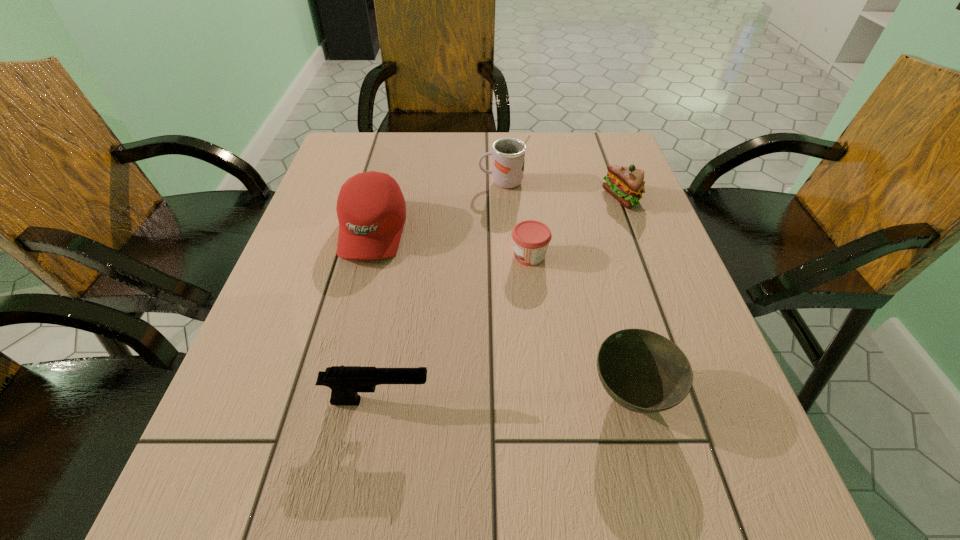
The height and width of the screenshot is (540, 960). Identify the location of free space that satisfies the following two spatial constraints: 1. on the side with the handle of the cup; 2. on the right side of the bowl. (516, 395).

Where is `vacant space that satisfies the following two spatial constraints: 1. on the back side of the bowl; 2. on the front label of the shortest object`? The height and width of the screenshot is (540, 960). vacant space that satisfies the following two spatial constraints: 1. on the back side of the bowl; 2. on the front label of the shortest object is located at coordinates (594, 255).

Identify the location of free spot that satisfies the following two spatial constraints: 1. on the side with the handle of the cup; 2. on the left side of the sandwich. (503, 198).

What are the coordinates of `vacant space that satisfies the following two spatial constraints: 1. on the front-facing side of the cap; 2. on the left side of the bowl` in the screenshot? It's located at (330, 395).